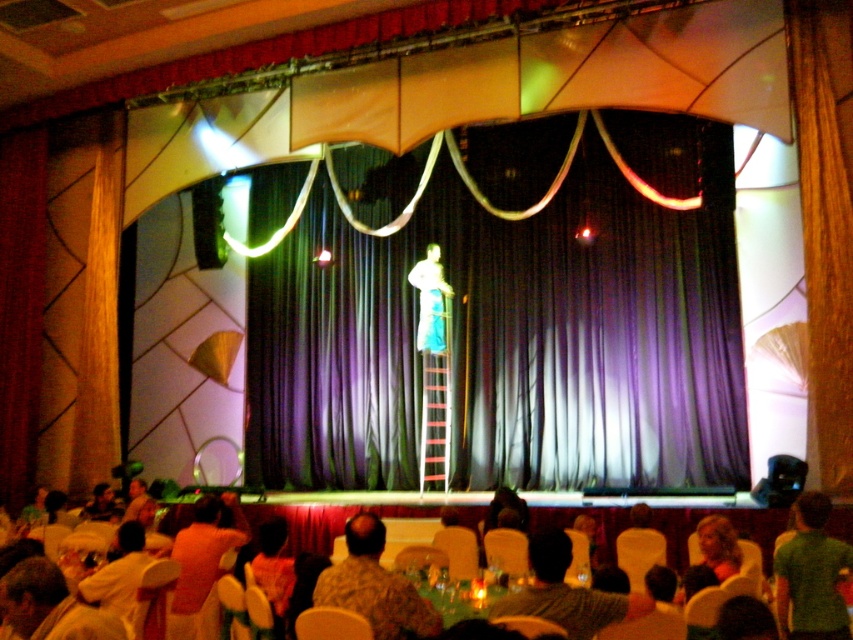
Who is positioned more to the left, camouflage shirt at lower center or orange fabric shirt at lower left?

orange fabric shirt at lower left is more to the left.

The width and height of the screenshot is (853, 640). In order to click on camouflage shirt at lower center in this screenshot , I will do `click(374, 586)`.

Is point (383, 573) farther from camera compared to point (202, 506)?

No, it is in front of (202, 506).

The width and height of the screenshot is (853, 640). What are the coordinates of `camouflage shirt at lower center` in the screenshot? It's located at (374, 586).

Is green fabric shirt at lower center in front of light blue fabric at center?

Yes.

Between point (596, 604) and point (416, 288), which one is positioned behind?

The point (416, 288) is behind.

Identify the location of green fabric shirt at lower center. The height and width of the screenshot is (640, 853). (566, 593).

Is green fabric shirt at lower right positioned in front of green fabric shirt at lower center?

That is False.

Does green fabric shirt at lower right appear on the right side of green fabric shirt at lower center?

Yes, green fabric shirt at lower right is to the right of green fabric shirt at lower center.

Image resolution: width=853 pixels, height=640 pixels. I want to click on green fabric shirt at lower right, so click(x=811, y=573).

Locate an element on the screen. The height and width of the screenshot is (640, 853). green fabric shirt at lower right is located at coordinates (811, 573).